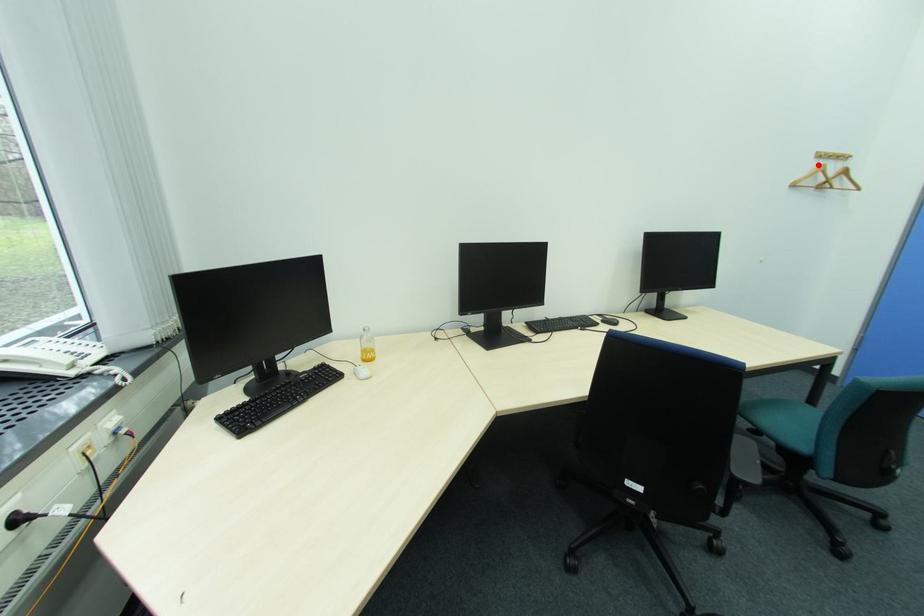
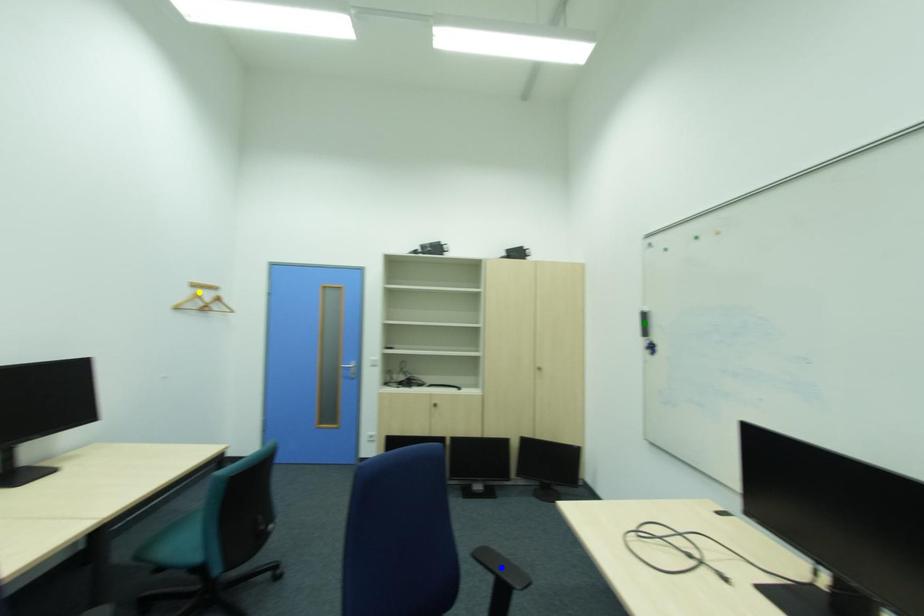
Question: I am providing you with two images of the same scene from different viewpoints. A red point is marked on the first image. You are given multiple points on the second image. In image 2, which mark is for the same physical point as the one in image 1?

Choices:
 (A) blue point
 (B) yellow point
 (C) green point

Answer: (B)